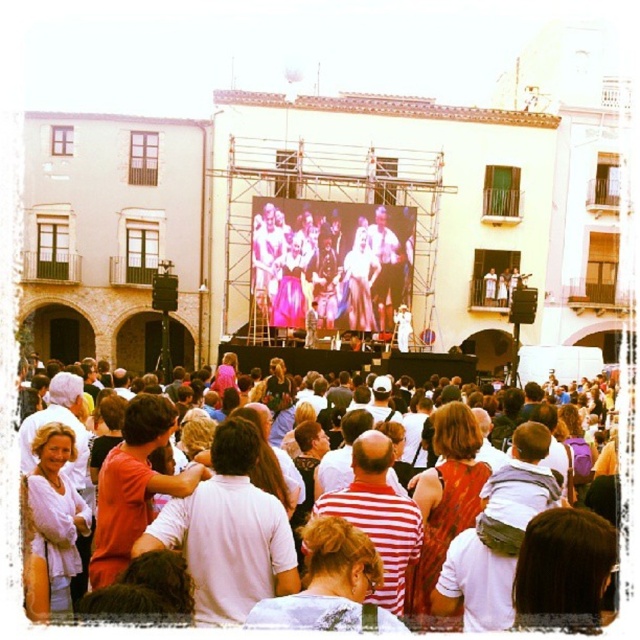
Does matte pink dress at center have a smaller size compared to white cotton crowd at center?

Correct, matte pink dress at center occupies less space than white cotton crowd at center.

Which is above, matte pink dress at center or white cotton crowd at center?

matte pink dress at center is above.

Identify the location of matte pink dress at center. (330, 262).